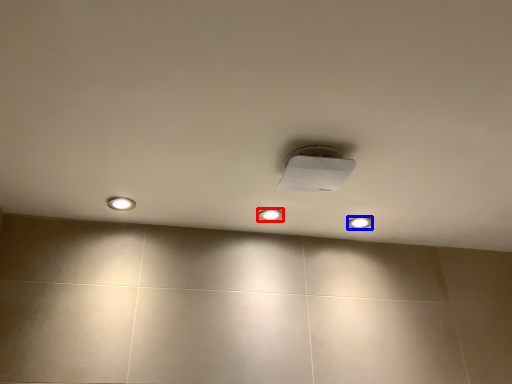
Question: Which object is closer to the camera taking this photo, dot (highlighted by a red box) or dot (highlighted by a blue box)?

Choices:
 (A) dot
 (B) dot

Answer: (A)